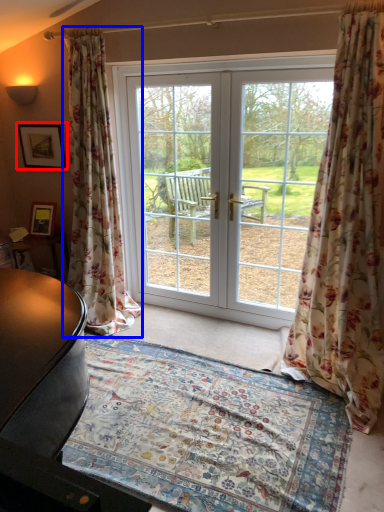
Question: Which object is closer to the camera taking this photo, picture frame (highlighted by a red box) or curtain (highlighted by a blue box)?

Choices:
 (A) picture frame
 (B) curtain

Answer: (B)